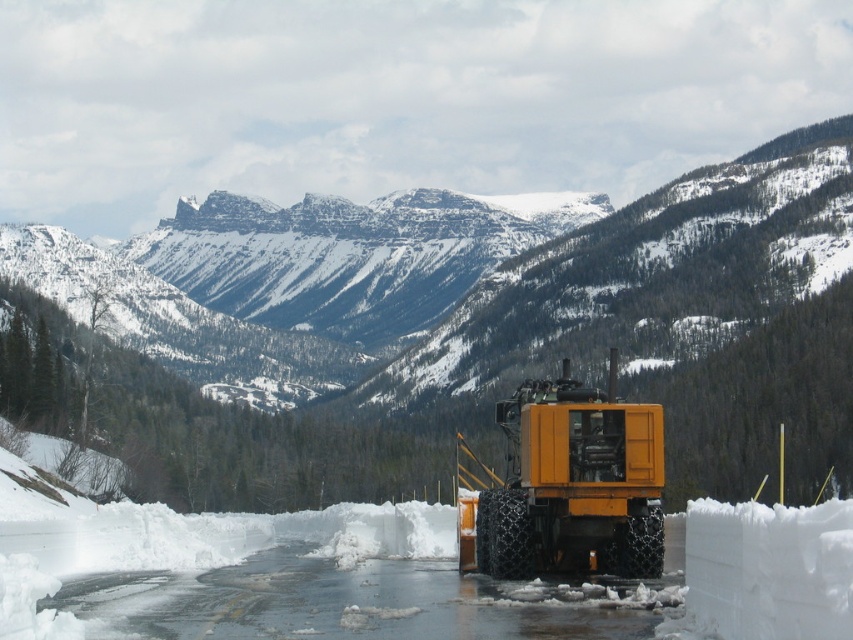
Question: Which object appears closest to the camera in this image?

Choices:
 (A) snowy rock mountain at center
 (B) yellow matte forklift at center

Answer: (B)

Question: Does snowy rock mountain at center have a larger size compared to yellow matte forklift at center?

Choices:
 (A) yes
 (B) no

Answer: (A)

Question: Does snowy rock mountain at center have a smaller size compared to yellow matte forklift at center?

Choices:
 (A) no
 (B) yes

Answer: (A)

Question: Does snowy rock mountain at center have a greater width compared to yellow matte forklift at center?

Choices:
 (A) no
 (B) yes

Answer: (B)